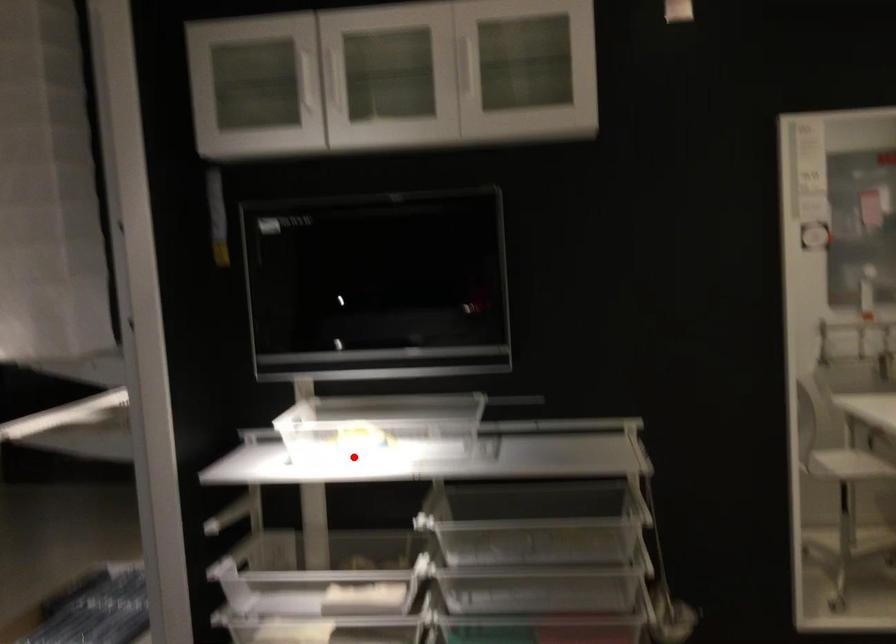
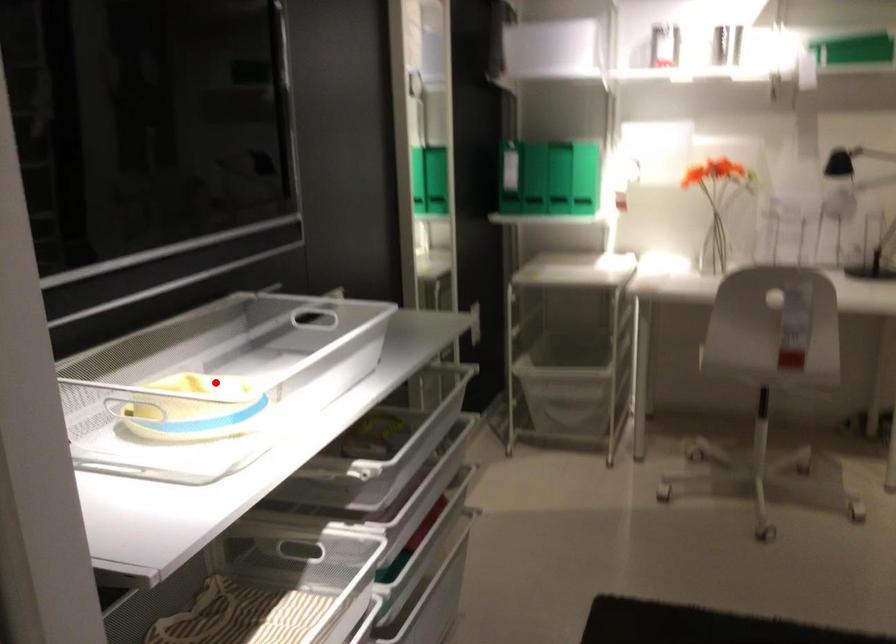
I am providing you with two images of the same scene from different viewpoints. A red point is marked on the first image and another point is marked on the second image. Are the points marked in image1 and image2 representing the same 3D position?

Yes